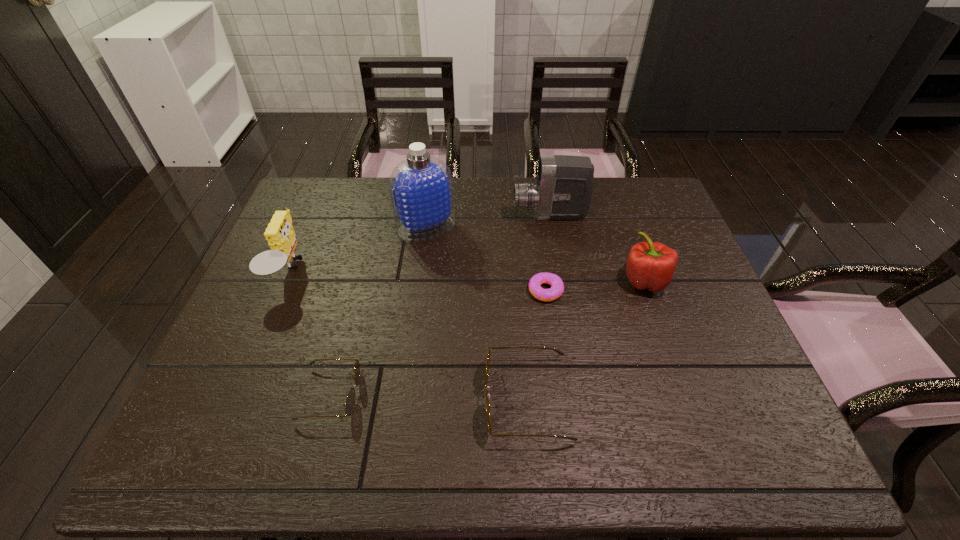
You are a GUI agent. You are given a task and a screenshot of the screen. Output one action in this format:
    pyautogui.click(x=<x>, y=<y>)
    Task: Click on the vacant area situated on the back of the rightmost object
    
    Given the screenshot: What is the action you would take?
    pyautogui.click(x=611, y=187)

Where is `free space located 0.300m on the left of the doughnut`? The height and width of the screenshot is (540, 960). free space located 0.300m on the left of the doughnut is located at coordinates (416, 291).

Identify the location of camcorder present at the far edge. This screenshot has width=960, height=540. (564, 186).

Find the location of a particular element. Image resolution: width=960 pixels, height=540 pixels. cleansing agent that is at the far edge is located at coordinates (421, 187).

This screenshot has height=540, width=960. In order to click on object present at the left edge in this screenshot , I will do `click(280, 235)`.

Identify the location of object present at the right edge. This screenshot has width=960, height=540. (651, 265).

Find the location of a particular element. This screenshot has height=540, width=960. free space at the far edge is located at coordinates (367, 219).

In the image, there is a desktop. In order to click on vacant space at the near edge in this screenshot , I will do `click(423, 378)`.

Find the location of `vacant space at the left edge`. vacant space at the left edge is located at coordinates (306, 230).

Identify the location of free region at the near left corner of the desktop. The height and width of the screenshot is (540, 960). (194, 409).